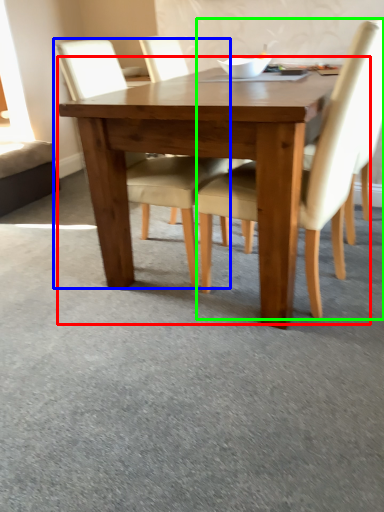
Question: Estimate the real-world distances between objects in this image. Which object is farther from kitchen & dining room table (highlighted by a red box), chair (highlighted by a blue box) or chair (highlighted by a green box)?

Choices:
 (A) chair
 (B) chair

Answer: (B)